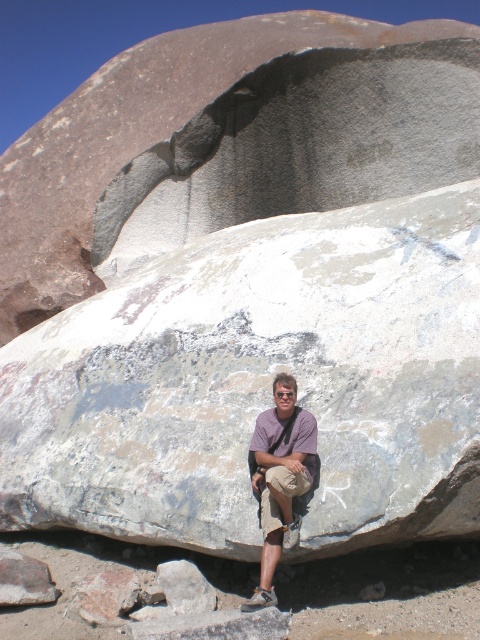
Is point (308, 452) more distant than point (278, 477)?

Yes, it is.

Can you confirm if purple cotton shirt at center is wider than khaki cotton shorts at center?

In fact, purple cotton shirt at center might be narrower than khaki cotton shorts at center.

Which is behind, point (264, 464) or point (261, 490)?

Point (261, 490)

Where is `purple cotton shirt at center`? Image resolution: width=480 pixels, height=640 pixels. purple cotton shirt at center is located at coordinates (280, 477).